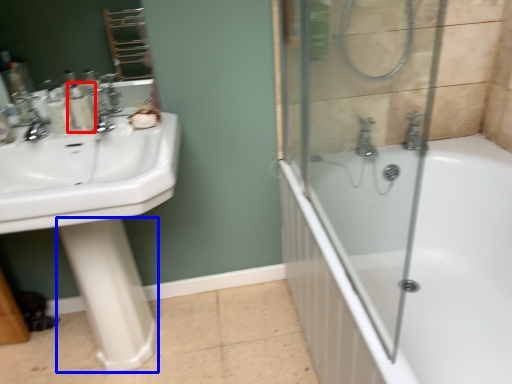
Question: Which object appears closest to the camera in this image, toiletry (highlighted by a red box) or bidet (highlighted by a blue box)?

Choices:
 (A) toiletry
 (B) bidet

Answer: (B)